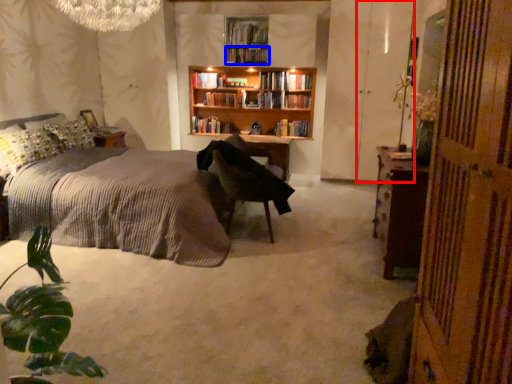
Question: Which of the following is the closest to the observer, screen door (highlighted by a red box) or book (highlighted by a blue box)?

Choices:
 (A) screen door
 (B) book

Answer: (A)